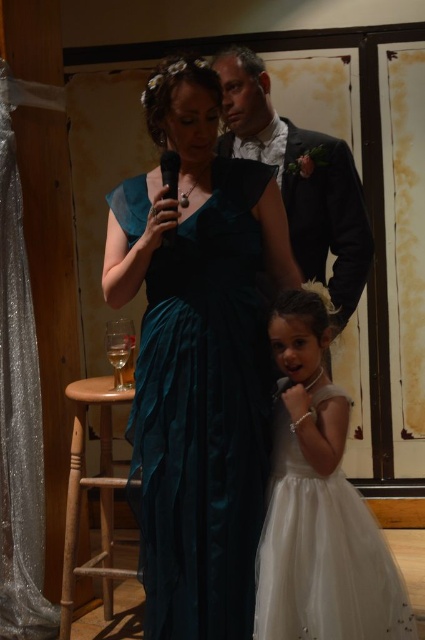
You are planning to seat guests at a table where both the white satin dress at center and the shiny black suit at center will be present. Which guest should you seat closer to the aisle for easier access?

The white satin dress at center is thinner than the shiny black suit at center, so seating the guest in the white satin dress at center closer to the aisle would allow easier access as they require less space.

You are a photographer positioned at the back of the venue. You need to take a photo that clearly shows both the white satin dress at center and the shiny black suit at center. Which one will appear larger in the photo?

The white satin dress at center will appear larger in the photo because it is closer to the viewer than the shiny black suit at center.